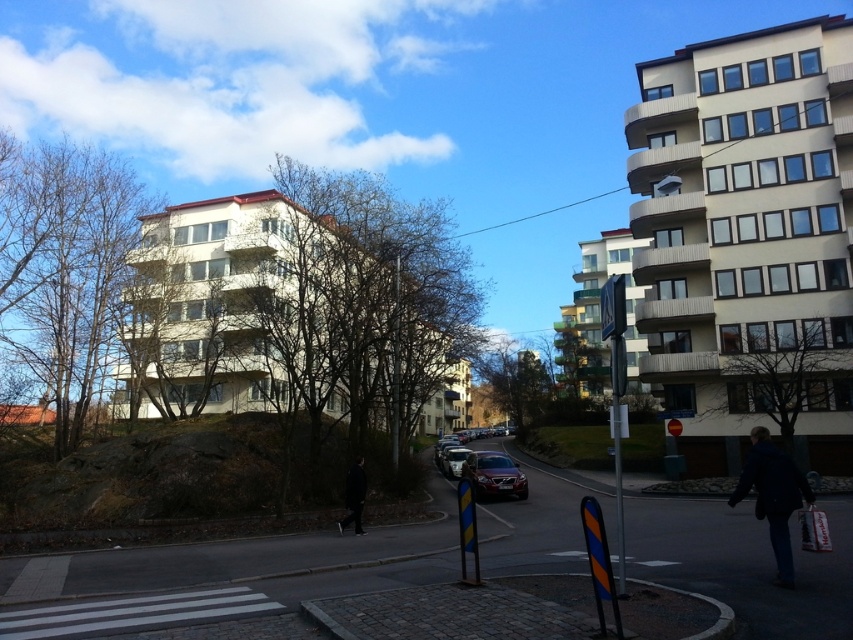
Who is lower down, reflective silver sign at center or shiny silver car at center?

shiny silver car at center

Based on the photo, does reflective silver sign at center have a greater height compared to shiny silver car at center?

Indeed, reflective silver sign at center has a greater height compared to shiny silver car at center.

Is point (606, 326) positioned after point (463, 456)?

That is False.

The image size is (853, 640). In order to click on reflective silver sign at center in this screenshot , I will do `click(616, 392)`.

Does satin silver sedan at center come in front of shiny silver car at center?

Yes, it is in front of shiny silver car at center.

Find the location of a particular element. satin silver sedan at center is located at coordinates tap(494, 474).

At what (x,y) coordinates should I click in order to perform the action: click on satin silver sedan at center. Please return your answer as a coordinate pair (x, y). Image resolution: width=853 pixels, height=640 pixels. Looking at the image, I should click on (494, 474).

Which is more to the right, satin silver sedan at center or black matte jacket at lower center?

Answer: satin silver sedan at center is more to the right.

Can you confirm if satin silver sedan at center is taller than black matte jacket at lower center?

Indeed, satin silver sedan at center has a greater height compared to black matte jacket at lower center.

This screenshot has height=640, width=853. I want to click on satin silver sedan at center, so click(x=494, y=474).